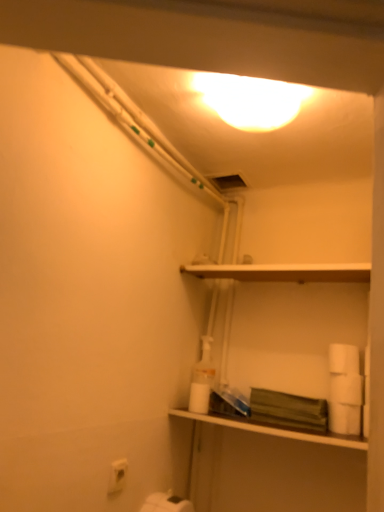
Question: Is white matte toilet paper at lower right, the 3th toilet paper viewed from the right, looking in the opposite direction of white matte shelf at upper center, the second shelf in the bottom-to-top sequence?

Choices:
 (A) yes
 (B) no

Answer: (B)

Question: Does white matte toilet paper at lower right, placed as the third toilet paper when sorted from left to right, come behind white matte shelf at upper center, marked as the first shelf in a top-to-bottom arrangement?

Choices:
 (A) no
 (B) yes

Answer: (B)

Question: Could you tell me if white matte toilet paper at lower right, placed as the third toilet paper when sorted from left to right, is facing white matte shelf at upper center, the second shelf in the bottom-to-top sequence?

Choices:
 (A) yes
 (B) no

Answer: (B)

Question: From a real-world perspective, does white matte toilet paper at lower right, placed as the third toilet paper when sorted from left to right, stand above white matte shelf at upper center, marked as the first shelf in a top-to-bottom arrangement?

Choices:
 (A) no
 (B) yes

Answer: (A)

Question: Is white matte toilet paper at lower right, placed as the third toilet paper when sorted from left to right, bigger than white matte shelf at upper center, marked as the first shelf in a top-to-bottom arrangement?

Choices:
 (A) yes
 (B) no

Answer: (B)

Question: From the image's perspective, is white matte toilet paper at lower right, placed as the third toilet paper when sorted from left to right, located above white matte shelf at upper center, the second shelf in the bottom-to-top sequence?

Choices:
 (A) no
 (B) yes

Answer: (A)

Question: Does matte white shelf at center, placed as the first shelf when sorted from bottom to top, come behind white matte toilet paper at lower center, which is the 2th toilet paper from left to right?

Choices:
 (A) no
 (B) yes

Answer: (A)

Question: Can you confirm if matte white shelf at center, placed as the first shelf when sorted from bottom to top, is taller than white matte toilet paper at lower center, marked as the fourth toilet paper in a right-to-left arrangement?

Choices:
 (A) no
 (B) yes

Answer: (A)

Question: Considering the relative positions of matte white shelf at center, the second shelf in the top-to-bottom sequence, and white matte toilet paper at lower center, which is the 2th toilet paper from left to right, in the image provided, is matte white shelf at center, the second shelf in the top-to-bottom sequence, to the left of white matte toilet paper at lower center, which is the 2th toilet paper from left to right, from the viewer's perspective?

Choices:
 (A) no
 (B) yes

Answer: (A)

Question: From the image's perspective, is matte white shelf at center, placed as the first shelf when sorted from bottom to top, located beneath white matte toilet paper at lower center, which is the 2th toilet paper from left to right?

Choices:
 (A) no
 (B) yes

Answer: (B)

Question: Does matte white shelf at center, the second shelf in the top-to-bottom sequence, have a greater width compared to white matte toilet paper at lower center, which is the 2th toilet paper from left to right?

Choices:
 (A) yes
 (B) no

Answer: (A)

Question: Is matte white shelf at center, placed as the first shelf when sorted from bottom to top, shorter than white matte toilet paper at lower center, marked as the fourth toilet paper in a right-to-left arrangement?

Choices:
 (A) no
 (B) yes

Answer: (B)

Question: Is white matte toilet paper at lower right, acting as the 1th toilet paper starting from the right, at the left side of white matte toilet paper at right, which is the second toilet paper from right to left?

Choices:
 (A) yes
 (B) no

Answer: (B)